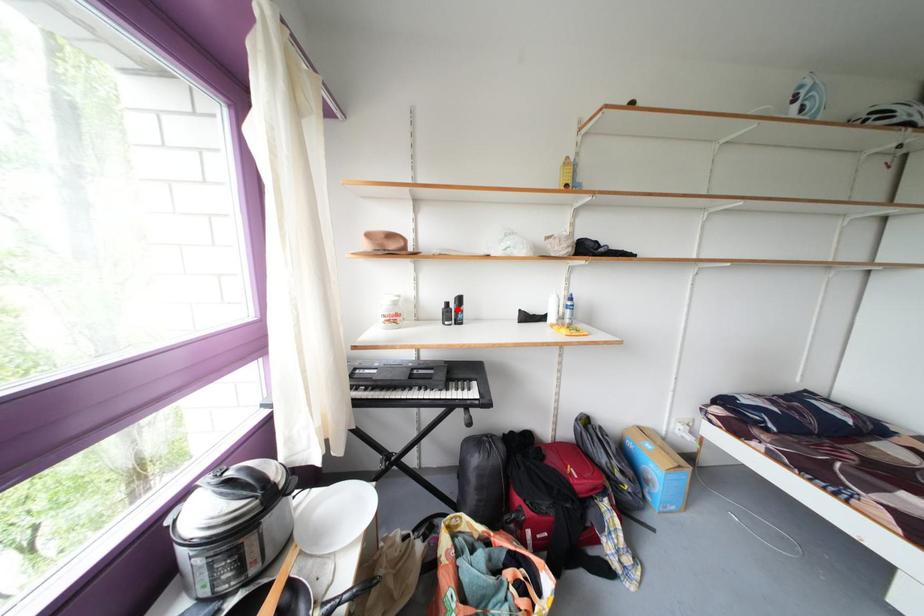
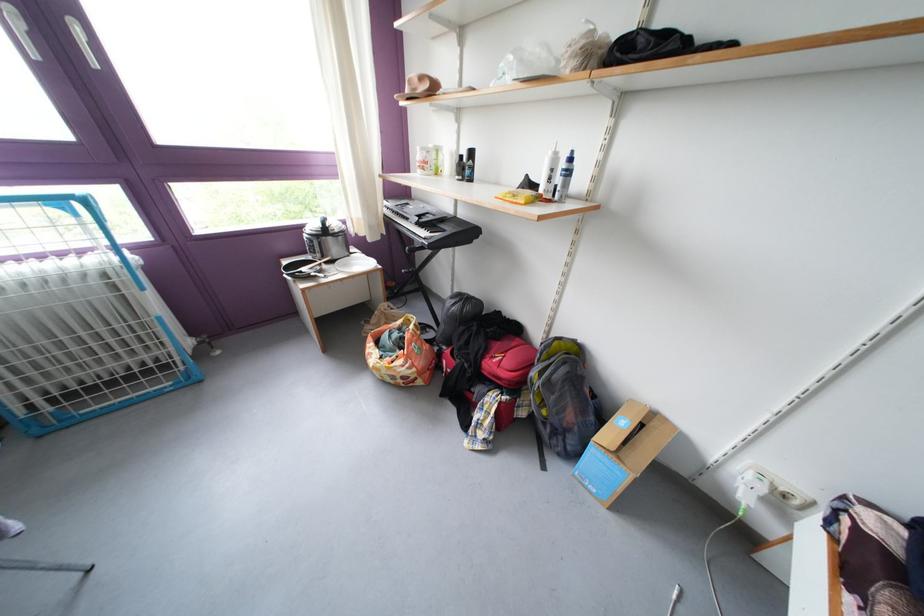
Question: A red point is marked in image1. In image2, is the corresponding 3D point closer to the camera or farther? Reply with the corresponding letter.

Choices:
 (A) The corresponding 3D point is closer.
 (B) The corresponding 3D point is farther.

Answer: (A)